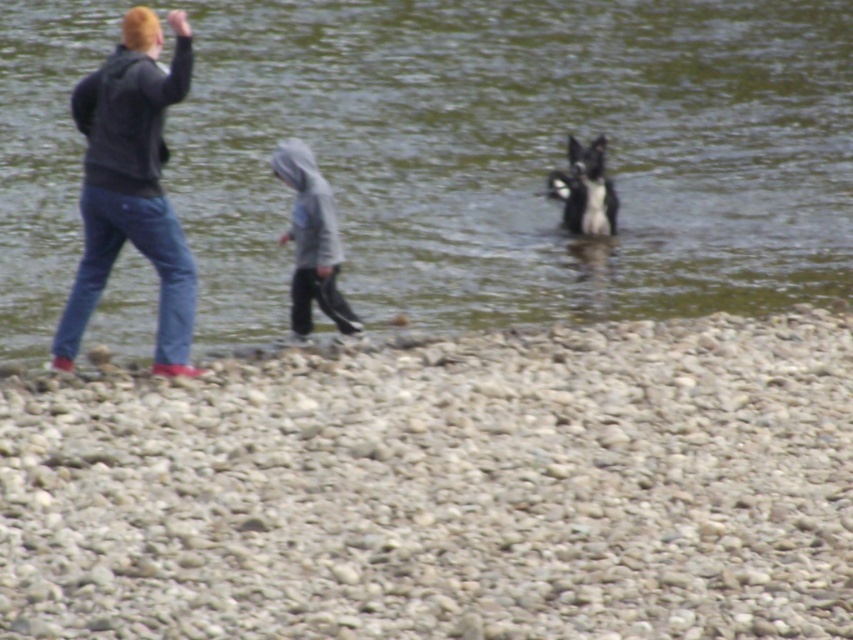
Question: In this image, where is smooth pebble at lower center located relative to greenish water at center?

Choices:
 (A) below
 (B) above

Answer: (A)

Question: Is matte black hoodie at left below gray fleece hoodie at center?

Choices:
 (A) yes
 (B) no

Answer: (B)

Question: Which object is farther from the camera taking this photo?

Choices:
 (A) matte black hoodie at left
 (B) greenish water at center
 (C) black and white fur dog at center

Answer: (C)

Question: Which object appears farthest from the camera in this image?

Choices:
 (A) greenish water at center
 (B) smooth pebble at lower center

Answer: (A)

Question: Is greenish water at center wider than black and white fur dog at center?

Choices:
 (A) yes
 (B) no

Answer: (A)

Question: Which point is farther to the camera?

Choices:
 (A) (265, 458)
 (B) (253, 96)
 (C) (65, 356)
 (D) (318, 227)

Answer: (B)